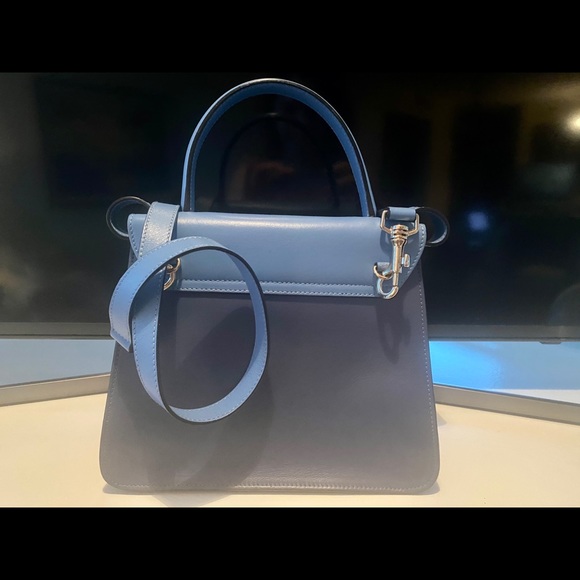
Locate an element on the screen. reflection of handle is located at coordinates (264, 123).